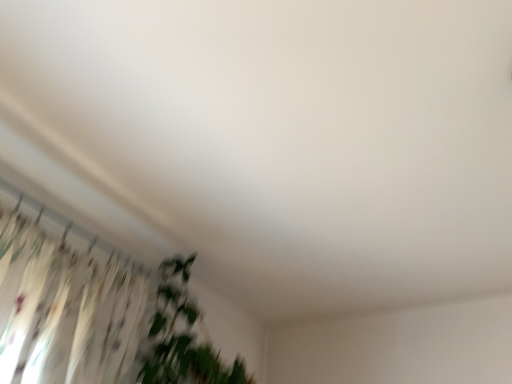
Locate an element on the screen. This screenshot has width=512, height=384. green leafy plant at lower left is located at coordinates (182, 337).

Describe the element at coordinates (182, 337) in the screenshot. The width and height of the screenshot is (512, 384). I see `green leafy plant at lower left` at that location.

This screenshot has height=384, width=512. I want to click on green leafy plant at lower left, so click(182, 337).